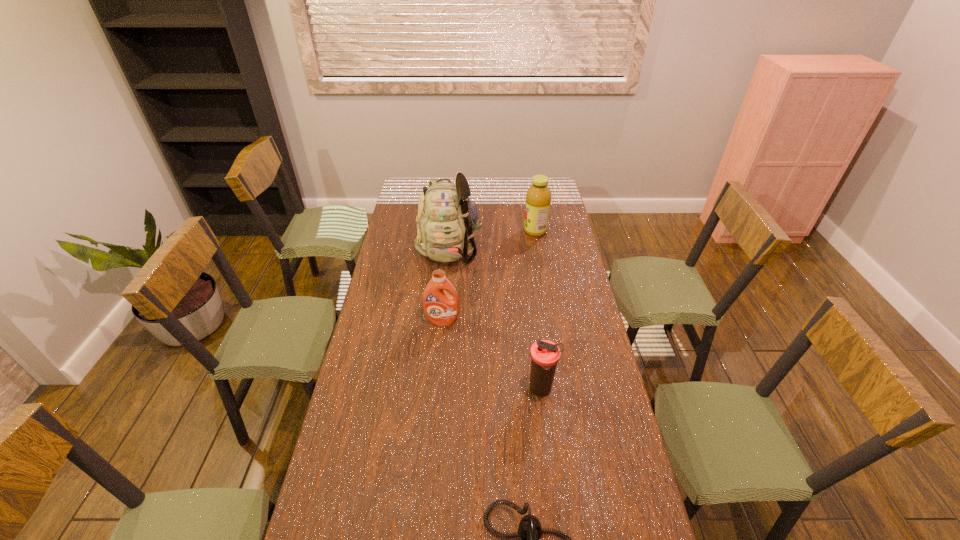
Locate an element on the screen. This screenshot has width=960, height=540. the tallest object is located at coordinates (447, 219).

Image resolution: width=960 pixels, height=540 pixels. Identify the location of fruit juice. (538, 197).

Locate an element on the screen. the third nearest object is located at coordinates (441, 309).

Identify the location of the fourth farthest object. This screenshot has height=540, width=960. (545, 355).

You are a GUI agent. You are given a task and a screenshot of the screen. Output one action in this format:
    pyautogui.click(x=<x>, y=<y>)
    Task: Click on the vacant area located 0.090m on the front-facing side of the backpack
    
    Given the screenshot: What is the action you would take?
    pyautogui.click(x=447, y=284)

This screenshot has height=540, width=960. Identify the location of vacant space located 0.190m on the front label of the fruit juice. (485, 231).

In order to click on free space located 0.330m on the front label of the fruit juice in this screenshot , I will do (x=457, y=231).

You are a GUI agent. You are given a task and a screenshot of the screen. Output one action in this format:
    pyautogui.click(x=<x>, y=<y>)
    Task: Click on the free region located 0.240m on the front label of the fruit juice
    Image resolution: width=960 pixels, height=540 pixels.
    Given the screenshot: What is the action you would take?
    pyautogui.click(x=475, y=231)

This screenshot has width=960, height=540. I want to click on vacant space located 0.200m on the front-facing side of the third farthest object, so [x=438, y=368].

The width and height of the screenshot is (960, 540). I want to click on vacant space situated 0.250m on the front of the fourth farthest object, so coord(552,479).